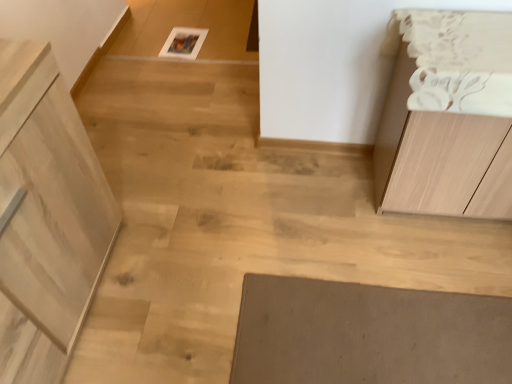
Question: Are light wood cabinet at left, the second cabinetry from the right, and light wood cabinet at right, positioned as the second cabinetry in left-to-right order, far apart?

Choices:
 (A) yes
 (B) no

Answer: (A)

Question: From the image's perspective, is light wood cabinet at left, the second cabinetry from the right, under light wood cabinet at right, positioned as the second cabinetry in left-to-right order?

Choices:
 (A) yes
 (B) no

Answer: (A)

Question: Is light wood cabinet at left, the second cabinetry from the right, aimed at light wood cabinet at right, positioned as the second cabinetry in left-to-right order?

Choices:
 (A) no
 (B) yes

Answer: (B)

Question: Is light wood cabinet at left, which is the 1th cabinetry from left to right, beside light wood cabinet at right, positioned as the second cabinetry in left-to-right order?

Choices:
 (A) yes
 (B) no

Answer: (B)

Question: Does light wood cabinet at left, which is the 1th cabinetry from left to right, have a greater height compared to light wood cabinet at right, the 1th cabinetry in the right-to-left sequence?

Choices:
 (A) yes
 (B) no

Answer: (A)

Question: Can you confirm if light wood cabinet at left, the second cabinetry from the right, is shorter than light wood cabinet at right, the 1th cabinetry in the right-to-left sequence?

Choices:
 (A) yes
 (B) no

Answer: (B)

Question: Is light wood cabinet at right, positioned as the second cabinetry in left-to-right order, surrounding light wood cabinet at left, which is the 1th cabinetry from left to right?

Choices:
 (A) no
 (B) yes

Answer: (A)

Question: Can you confirm if light wood cabinet at right, the 1th cabinetry in the right-to-left sequence, is taller than light wood cabinet at left, which is the 1th cabinetry from left to right?

Choices:
 (A) no
 (B) yes

Answer: (A)

Question: Is light wood cabinet at right, positioned as the second cabinetry in left-to-right order, oriented away from light wood cabinet at left, which is the 1th cabinetry from left to right?

Choices:
 (A) yes
 (B) no

Answer: (B)

Question: Is light wood cabinet at right, positioned as the second cabinetry in left-to-right order, outside of light wood cabinet at left, which is the 1th cabinetry from left to right?

Choices:
 (A) yes
 (B) no

Answer: (A)

Question: From a real-world perspective, is light wood cabinet at right, the 1th cabinetry in the right-to-left sequence, physically above light wood cabinet at left, which is the 1th cabinetry from left to right?

Choices:
 (A) no
 (B) yes

Answer: (A)

Question: Is light wood cabinet at right, positioned as the second cabinetry in left-to-right order, wider than light wood cabinet at left, the second cabinetry from the right?

Choices:
 (A) no
 (B) yes

Answer: (A)

Question: Considering the positions of light wood cabinet at right, the 1th cabinetry in the right-to-left sequence, and light wood cabinet at left, the second cabinetry from the right, in the image, is light wood cabinet at right, the 1th cabinetry in the right-to-left sequence, wider or thinner than light wood cabinet at left, the second cabinetry from the right,?

Choices:
 (A) thin
 (B) wide

Answer: (A)